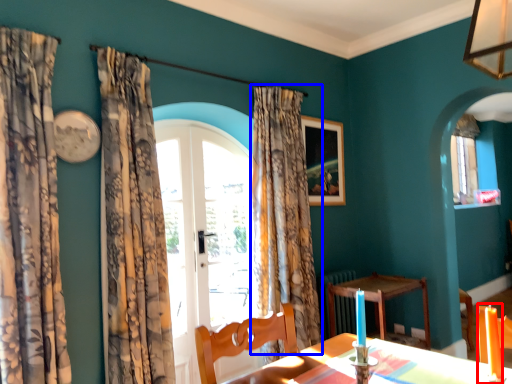
Question: Among these objects, which one is farthest to the camera, candle (highlighted by a red box) or curtain (highlighted by a blue box)?

Choices:
 (A) candle
 (B) curtain

Answer: (B)